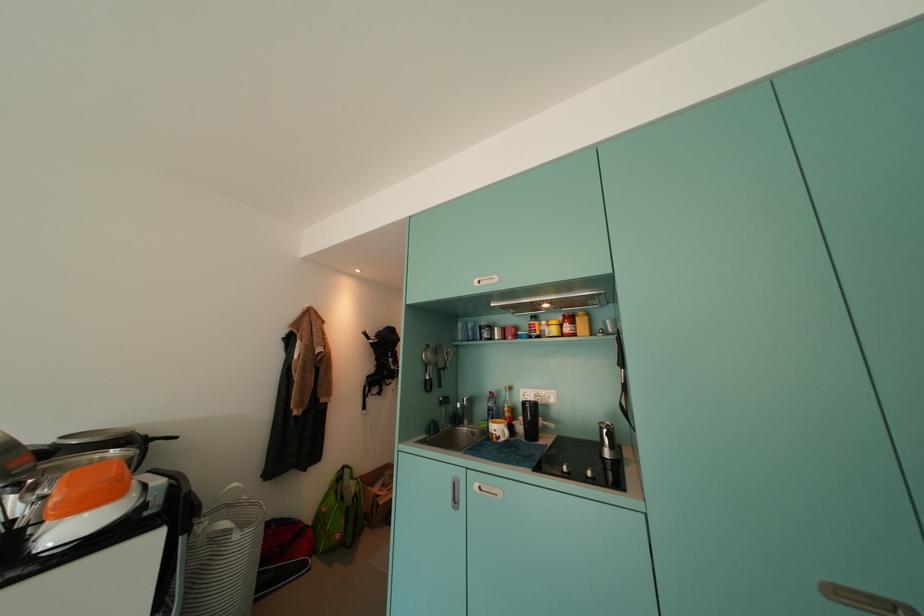
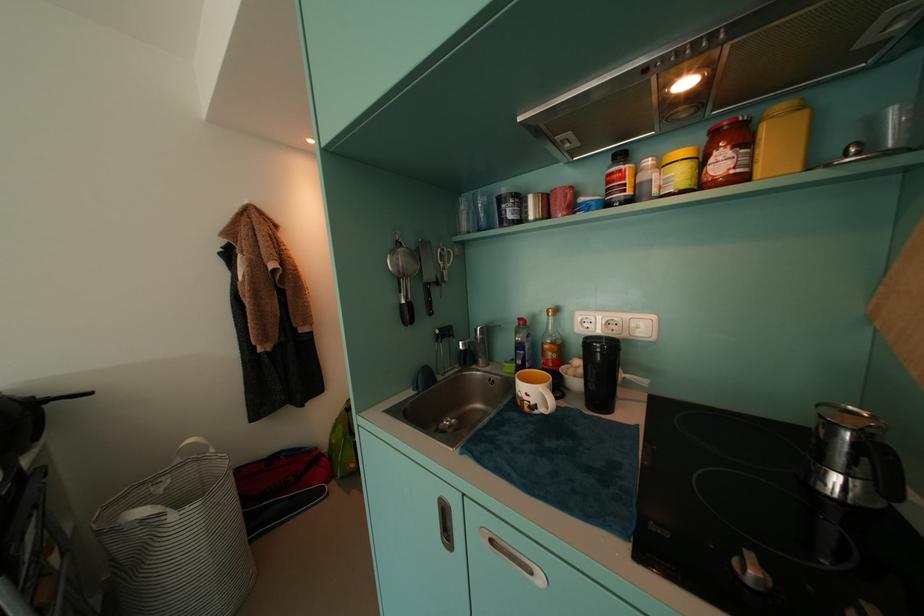
In the second image, find the point that corresponds to (575,331) in the first image.

(730, 166)